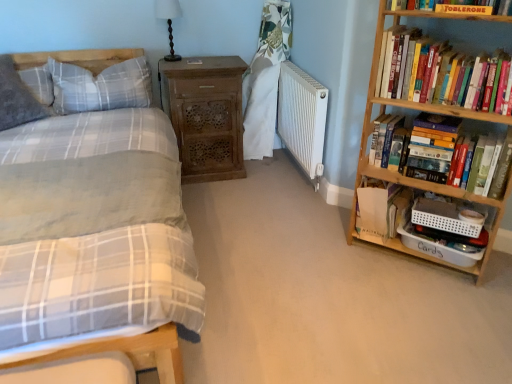
Identify the location of free space on the front side of wooden carved nightstand at left. (219, 201).